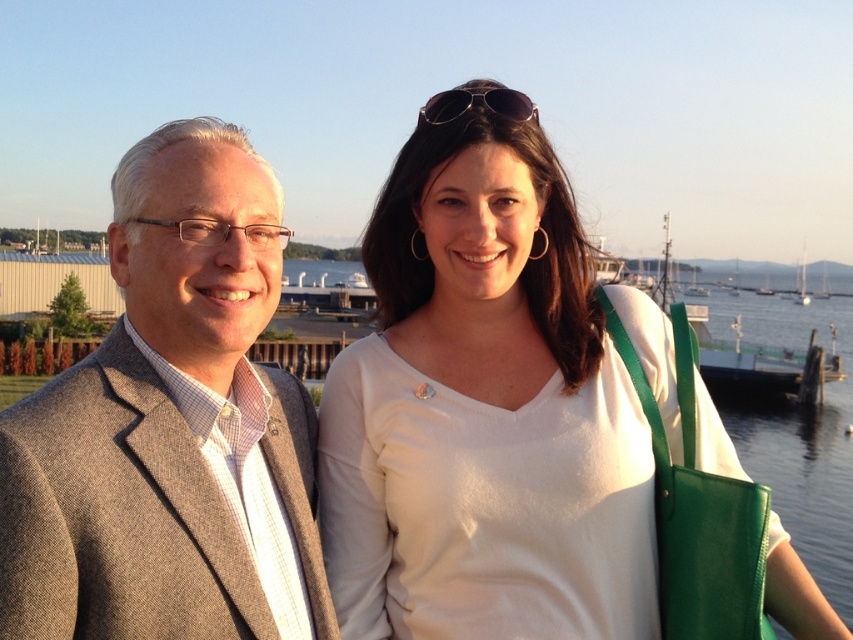
Question: Can you confirm if white matte shirt at upper right is positioned above gray wool suit at left?

Choices:
 (A) no
 (B) yes

Answer: (A)

Question: Which of the following is the farthest from the observer?

Choices:
 (A) white matte shirt at upper right
 (B) gray wool suit at left

Answer: (A)

Question: Does white matte shirt at upper right appear over gray wool suit at left?

Choices:
 (A) no
 (B) yes

Answer: (A)

Question: Observing the image, what is the correct spatial positioning of white matte shirt at upper right in reference to gray wool suit at left?

Choices:
 (A) left
 (B) right

Answer: (B)